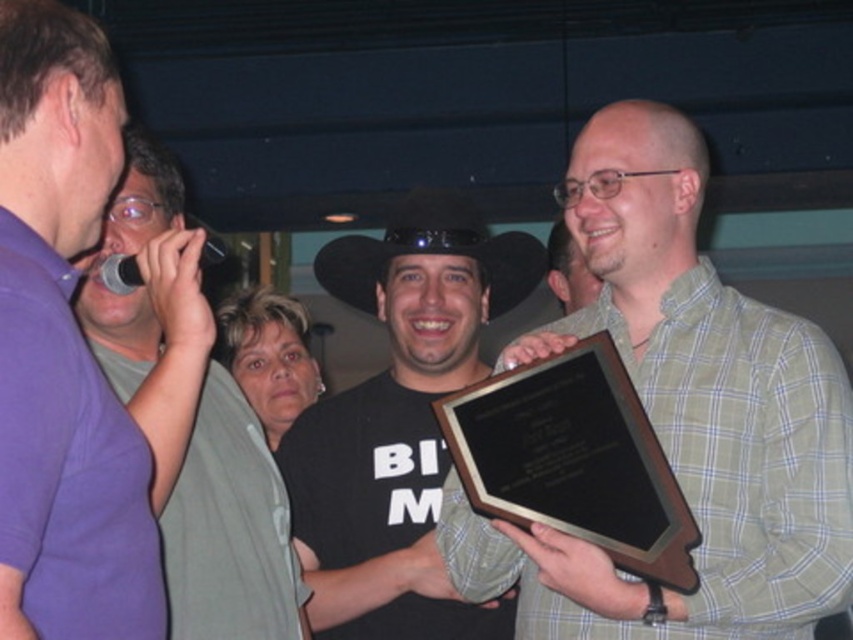
Who is positioned more to the right, purple shirt at left or green plaid shirt at upper right?

From the viewer's perspective, green plaid shirt at upper right appears more on the right side.

Is point (39, 131) closer to viewer compared to point (567, 253)?

That is True.

Where is `purple shirt at left`? The height and width of the screenshot is (640, 853). purple shirt at left is located at coordinates (62, 349).

Which of these two, green plaid shirt at center or purple shirt at left, stands taller?

green plaid shirt at center

Can you confirm if green plaid shirt at center is positioned above purple shirt at left?

Actually, green plaid shirt at center is below purple shirt at left.

Is point (604, 134) positioned before point (120, 465)?

No, (604, 134) is behind (120, 465).

At what (x,y) coordinates should I click in order to perform the action: click on green plaid shirt at center. Please return your answer as a coordinate pair (x, y). Looking at the image, I should click on (697, 404).

Can you confirm if black polished wood plaque at center is taller than green plaid shirt at upper right?

Yes.

Can you confirm if black polished wood plaque at center is positioned below green plaid shirt at upper right?

Yes.

Describe the element at coordinates (573, 460) in the screenshot. I see `black polished wood plaque at center` at that location.

Locate an element on the screen. Image resolution: width=853 pixels, height=640 pixels. black polished wood plaque at center is located at coordinates (573, 460).